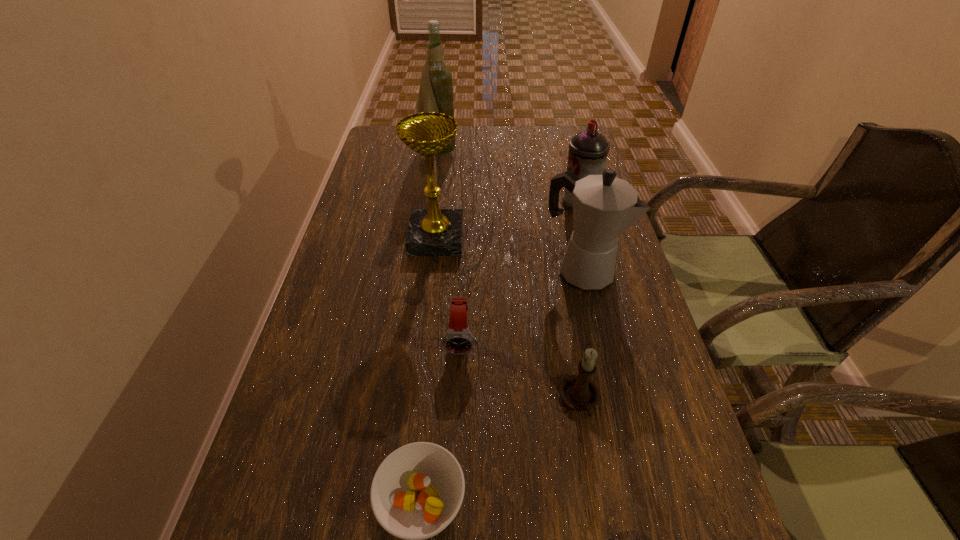
Find the location of `the second closest object relative to the wine bottle`. the second closest object relative to the wine bottle is located at coordinates (588, 150).

Find the location of a particular element. The height and width of the screenshot is (540, 960). free space that satisfies the following two spatial constraints: 1. on the front-facing side of the coffeepot; 2. on the right side of the award is located at coordinates (433, 271).

Image resolution: width=960 pixels, height=540 pixels. I want to click on free space that satisfies the following two spatial constraints: 1. on the front side of the sixth nearest object; 2. on the front-facing side of the award, so tap(588, 239).

The width and height of the screenshot is (960, 540). What are the coordinates of `vacant space that satisfies the following two spatial constraints: 1. on the front-facing side of the coffeepot; 2. on the left side of the award` in the screenshot? It's located at (433, 271).

The image size is (960, 540). I want to click on free space that satisfies the following two spatial constraints: 1. on the back side of the coffeepot; 2. on the front-facing side of the award, so click(573, 239).